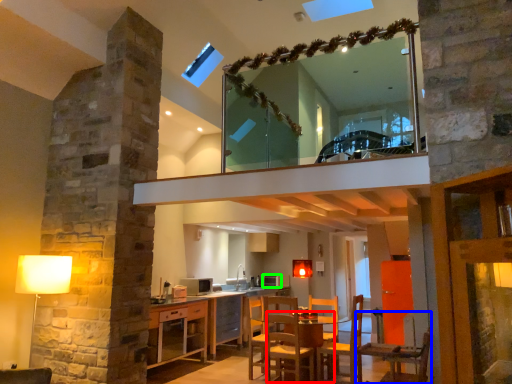
Question: Which object is the farthest from table (highlighted by a red box)? Choose among these: chair (highlighted by a blue box) or appliance (highlighted by a green box).

Choices:
 (A) chair
 (B) appliance

Answer: (B)